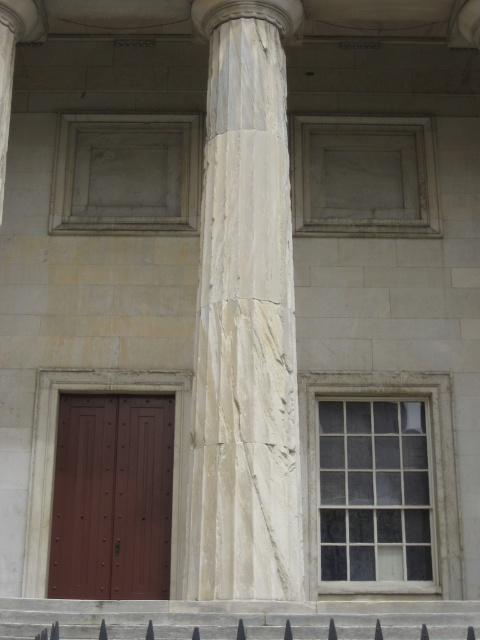
Question: Which object appears farthest from the camera in this image?

Choices:
 (A) black metal fence at lower center
 (B) white marble column at center

Answer: (B)

Question: Does white marble column at center have a lesser width compared to black metal fence at lower center?

Choices:
 (A) no
 (B) yes

Answer: (B)

Question: Can you confirm if white marble column at center is smaller than black metal fence at lower center?

Choices:
 (A) yes
 (B) no

Answer: (B)

Question: Is white marble column at center positioned in front of black metal fence at lower center?

Choices:
 (A) no
 (B) yes

Answer: (A)